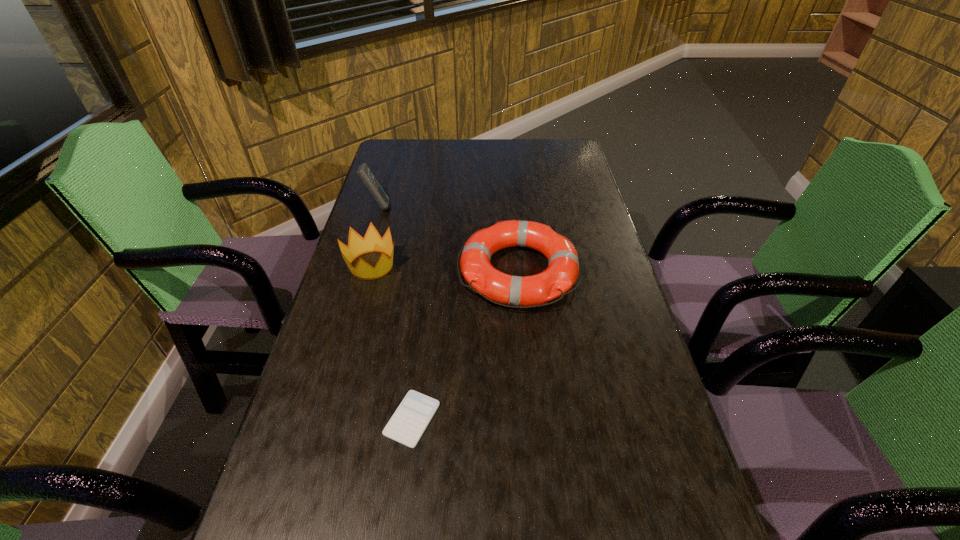
I want to click on free location located on the back of the shortest object, so click(x=425, y=312).

The height and width of the screenshot is (540, 960). I want to click on calculator at the left edge, so click(x=364, y=173).

The height and width of the screenshot is (540, 960). I want to click on crown present at the left edge, so click(x=372, y=242).

The height and width of the screenshot is (540, 960). Find the location of `object at the right edge`. object at the right edge is located at coordinates (563, 267).

In order to click on free space at the far edge of the desktop in this screenshot , I will do `click(509, 141)`.

This screenshot has width=960, height=540. In the image, there is a desktop. Identify the location of free space at the left edge. (397, 253).

The height and width of the screenshot is (540, 960). Identify the location of vacant point at the right edge. (595, 262).

Locate an element on the screen. free space at the far right corner of the desktop is located at coordinates (564, 148).

Identify the location of vacant point located between the nearer calculator and the crown. (392, 342).

Where is `vacant point located between the shorter calculator and the taller calculator`? This screenshot has width=960, height=540. vacant point located between the shorter calculator and the taller calculator is located at coordinates (395, 313).